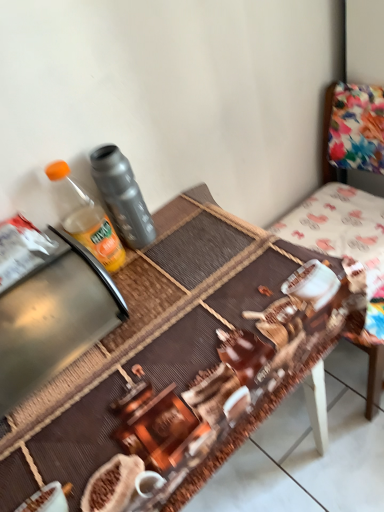
I want to click on vacant region to the right of metallic stainless steel appliance at left, so click(168, 301).